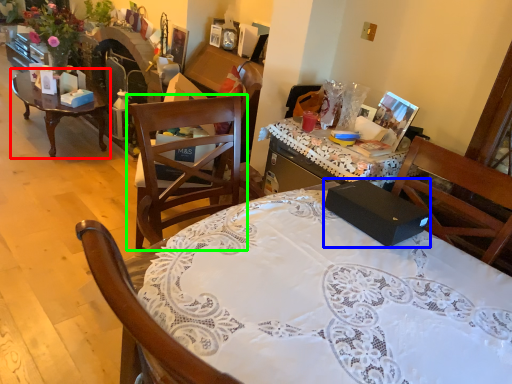
Question: Which object is positioned farthest from coffee table (highlighted by a red box)? Select from box (highlighted by a blue box) and chair (highlighted by a green box).

Choices:
 (A) box
 (B) chair

Answer: (A)